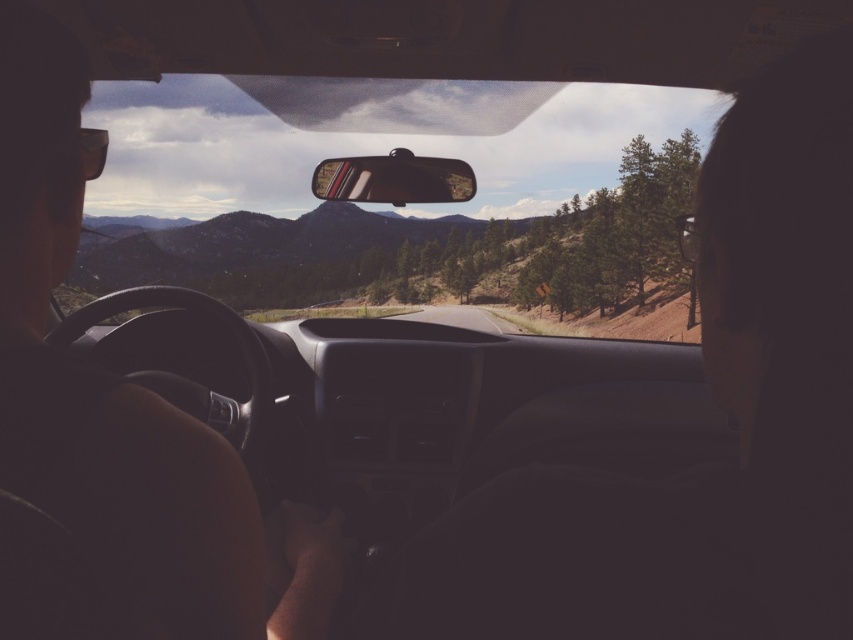
Can you confirm if matte black steering wheel at left is positioned to the right of matte plastic view mirror at center?

In fact, matte black steering wheel at left is to the left of matte plastic view mirror at center.

Can you confirm if matte black steering wheel at left is thinner than matte plastic view mirror at center?

Indeed, matte black steering wheel at left has a lesser width compared to matte plastic view mirror at center.

Is point (16, 179) farther from camera compared to point (473, 196)?

That is False.

Locate an element on the screen. matte black steering wheel at left is located at coordinates (122, 400).

Who is positioned more to the left, transparent glass windshield at center or matte black steering wheel at left?

matte black steering wheel at left

Is transparent glass windshield at center to the left of matte black steering wheel at left from the viewer's perspective?

Incorrect, transparent glass windshield at center is not on the left side of matte black steering wheel at left.

Where is `transparent glass windshield at center`? This screenshot has height=640, width=853. transparent glass windshield at center is located at coordinates (398, 208).

I want to click on transparent glass windshield at center, so click(398, 208).

Does transparent glass windshield at center have a larger size compared to matte plastic view mirror at center?

Yes.

Find the location of a particular element. The width and height of the screenshot is (853, 640). transparent glass windshield at center is located at coordinates (398, 208).

Identify the location of transparent glass windshield at center. (398, 208).